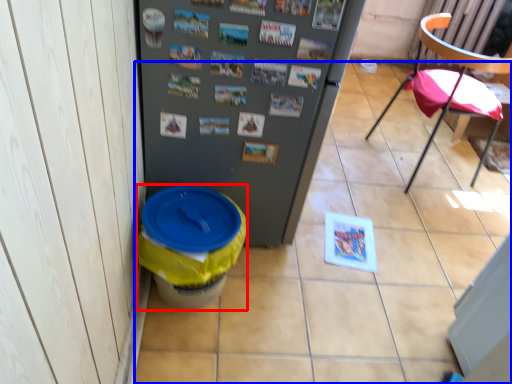
Question: Which of the following is the closest to the observer, potty (highlighted by a red box) or tile (highlighted by a blue box)?

Choices:
 (A) potty
 (B) tile

Answer: (A)